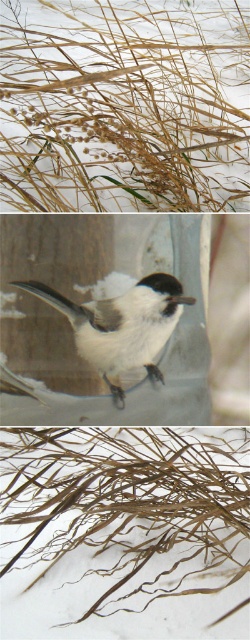
Does golden straw grass at upper center appear on the left side of brown dry reed at lower center?

Indeed, golden straw grass at upper center is positioned on the left side of brown dry reed at lower center.

Does golden straw grass at upper center have a greater width compared to brown dry reed at lower center?

Indeed, golden straw grass at upper center has a greater width compared to brown dry reed at lower center.

Between point (130, 125) and point (67, 468), which one is positioned behind?

Positioned behind is point (130, 125).

Locate an element on the screen. The image size is (250, 640). golden straw grass at upper center is located at coordinates (125, 104).

Which is in front, point (142, 189) or point (108, 355)?

Point (108, 355)

The image size is (250, 640). Find the location of `golden straw grass at upper center`. golden straw grass at upper center is located at coordinates (125, 104).

Which is in front, point (217, 474) or point (176, 314)?

Point (176, 314) is in front.

Can you confirm if brown dry reed at lower center is positioned below white matte bird at center?

Indeed, brown dry reed at lower center is positioned under white matte bird at center.

Who is more forward, (96, 605) or (124, 314)?

Point (124, 314)

Find the location of a particular element. Image resolution: width=250 pixels, height=640 pixels. brown dry reed at lower center is located at coordinates (131, 499).